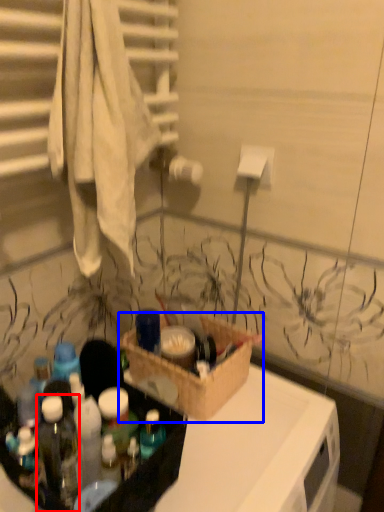
Question: Which of the following is the farthest to the observer, bottle (highlighted by a red box) or box (highlighted by a blue box)?

Choices:
 (A) bottle
 (B) box

Answer: (B)